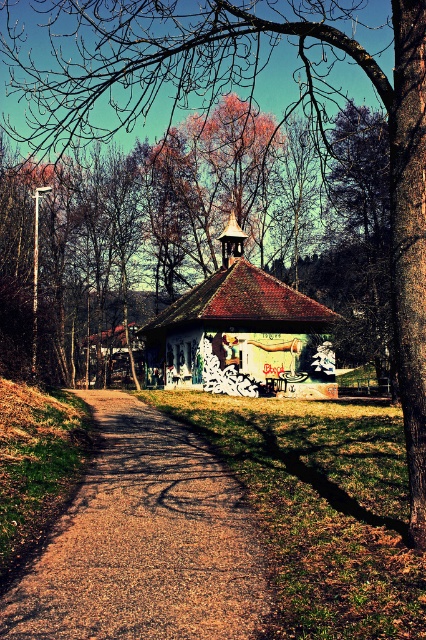
You are a hiker who wants to reach the grungy painted hut at center from the brown gravel path at center. Which direction should you move relative to the path?

The brown gravel path at center is positioned on the left side of grungy painted hut at center, so you should move to the right from the path to reach the grungy painted hut at center.

You are standing at point (144, 541) in this scene. What is the object located exactly at this point?

The object located exactly at point (144, 541) is the brown gravel path at center.